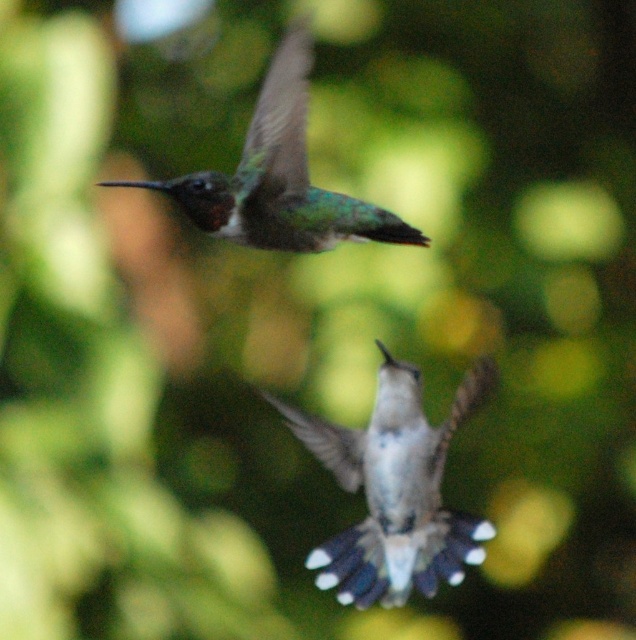
You are a birdwatcher trying to photograph two hummingbirds. You notice the white glossy hummingbird at center and the green iridescent hummingbird at upper center. Which hummingbird is closer to your camera lens?

The white glossy hummingbird at center is closer to the camera lens because it is further to the viewer than the green iridescent hummingbird at upper center.

You are a birdwatcher observing two hummingbirds in flight. You notice the white glossy hummingbird at center and the green iridescent hummingbird at upper center. Which of these two hummingbirds is taller?

The white glossy hummingbird at center has a greater height compared to the green iridescent hummingbird at upper center, so the white glossy hummingbird at center is taller.

You are observing two points in the image of the hummingbirds. Which point, point (x=364, y=557) or point (x=291, y=172), is closer to the camera?

Point (x=364, y=557) is further to the camera than point (x=291, y=172), so the closer point is point (x=291, y=172).